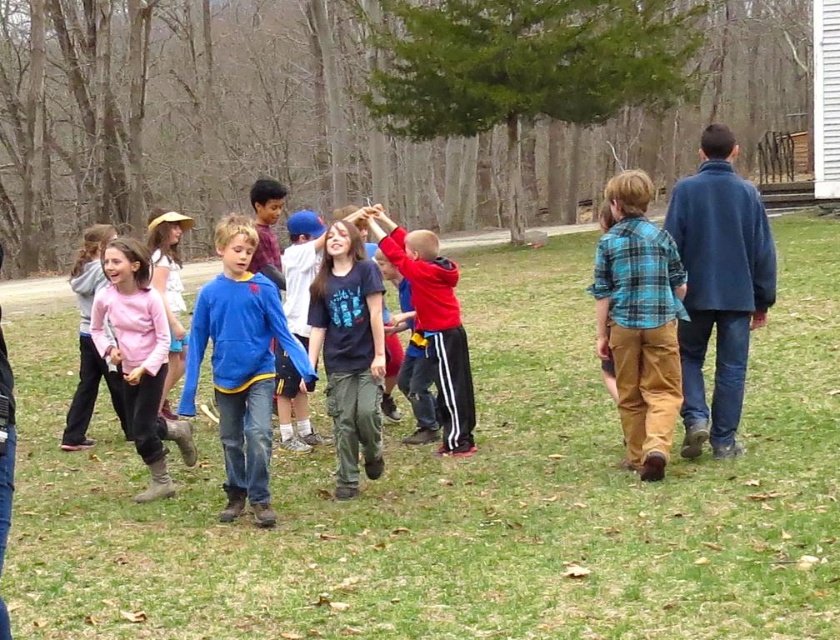
Question: Which of the following is the farthest from the observer?

Choices:
 (A) (87, 420)
 (B) (231, 324)
 (C) (172, 237)

Answer: (A)

Question: Does blue fleece jacket at center appear on the left side of matte pink sweater at left?

Choices:
 (A) yes
 (B) no

Answer: (B)

Question: Which point appears closest to the camera in this image?

Choices:
 (A) (166, 292)
 (B) (239, 353)
 (C) (631, 292)

Answer: (B)

Question: Where is blue plaid shirt at center located in relation to pink fabric shirt at left in the image?

Choices:
 (A) left
 (B) right

Answer: (B)

Question: Is blue plaid shirt at center positioned at the back of pink fabric shirt at left?

Choices:
 (A) yes
 (B) no

Answer: (B)

Question: Which point is closer to the camera?

Choices:
 (A) (378, 353)
 (B) (449, 422)
 (C) (92, 360)
 (D) (165, 276)

Answer: (A)